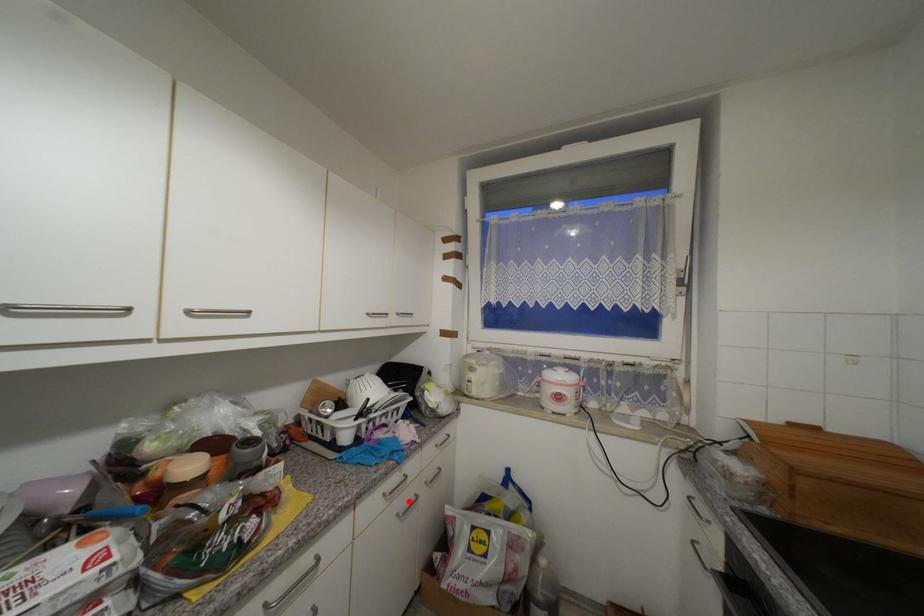
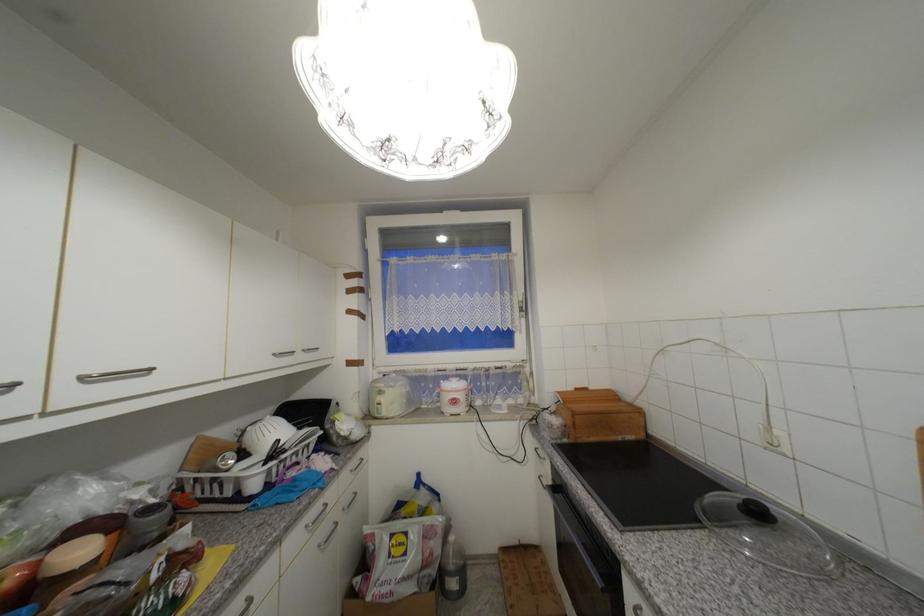
Question: I am providing you with two images of the same scene from different viewpoints. Image1 has a red point marked. In image2, the corresponding 3D location appears at what relative position? Reply with the corresponding letter.

Choices:
 (A) Closer
 (B) Farther

Answer: (A)